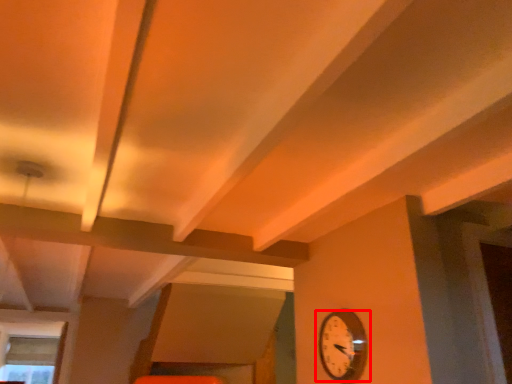
Question: From the image, what is the correct spatial relationship of wall clock (annotated by the red box) in relation to window?

Choices:
 (A) left
 (B) right

Answer: (B)